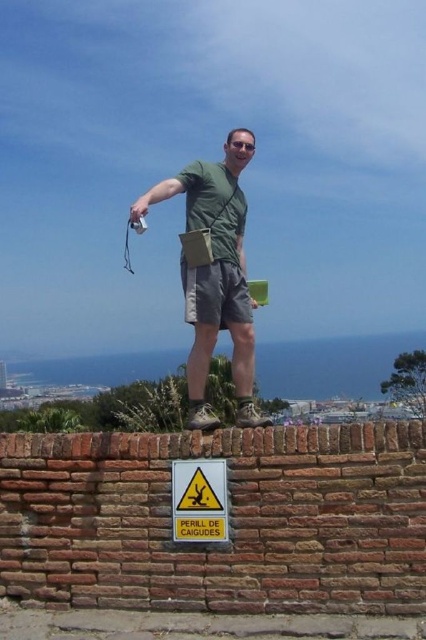
Which is behind, point (207, 198) or point (247, 148)?

The point (247, 148) is more distant.

Is green matte t-shirt at center to the right of sunglasses at center from the viewer's perspective?

In fact, green matte t-shirt at center is to the left of sunglasses at center.

Does point (244, 339) come farther from viewer compared to point (253, 147)?

No.

Where is `green matte t-shirt at center`? The width and height of the screenshot is (426, 640). green matte t-shirt at center is located at coordinates coord(215,280).

Is yellowmaterial/texturewarning sign at lower center wider than sunglasses at center?

Indeed, yellowmaterial/texturewarning sign at lower center has a greater width compared to sunglasses at center.

Between point (175, 499) and point (227, 145), which one is positioned in front?

Point (175, 499) is in front.

The width and height of the screenshot is (426, 640). Identify the location of yellowmaterial/texturewarning sign at lower center. (198, 500).

Describe the element at coordinates (215, 280) in the screenshot. This screenshot has width=426, height=640. I see `green matte t-shirt at center` at that location.

At what (x,y) coordinates should I click in order to perform the action: click on green matte t-shirt at center. Please return your answer as a coordinate pair (x, y). Looking at the image, I should click on tap(215, 280).

Between point (233, 156) and point (201, 464), which one is positioned in front?

Point (201, 464)

Find the location of `green matte t-shirt at center`. green matte t-shirt at center is located at coordinates (215, 280).